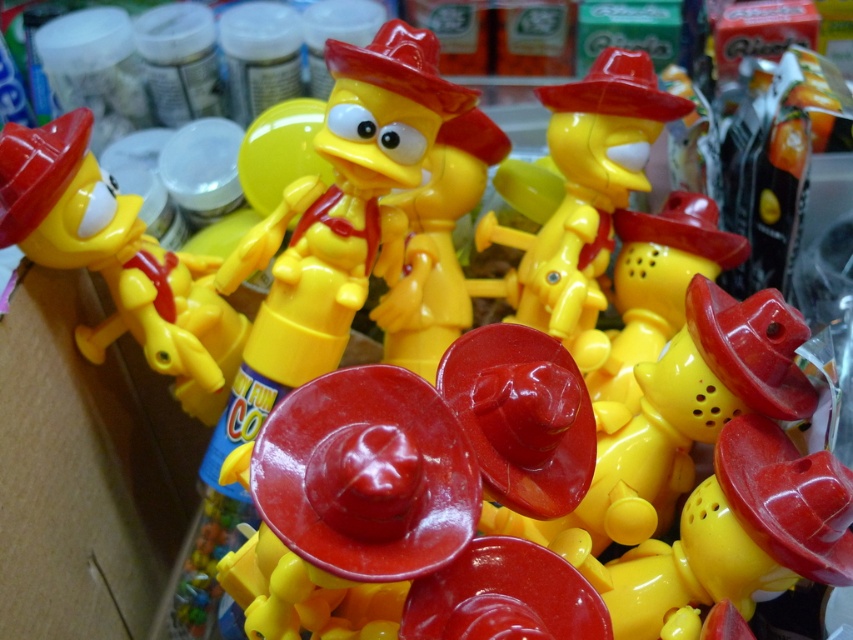
From the picture: Does matte yellow toy at center appear on the left side of matte plastic toy at center?

Yes, matte yellow toy at center is to the left of matte plastic toy at center.

Between matte yellow toy at center and matte plastic toy at center, which one appears on the right side from the viewer's perspective?

From the viewer's perspective, matte plastic toy at center appears more on the right side.

This screenshot has width=853, height=640. What are the coordinates of `matte yellow toy at center` in the screenshot? It's located at [x=119, y=260].